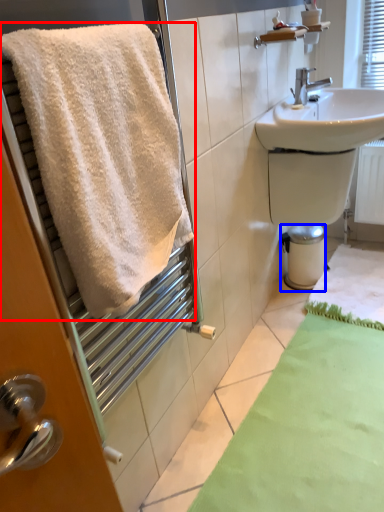
Question: Which object appears closest to the camera in this image, towel (highlighted by a red box) or bidet (highlighted by a blue box)?

Choices:
 (A) towel
 (B) bidet

Answer: (A)